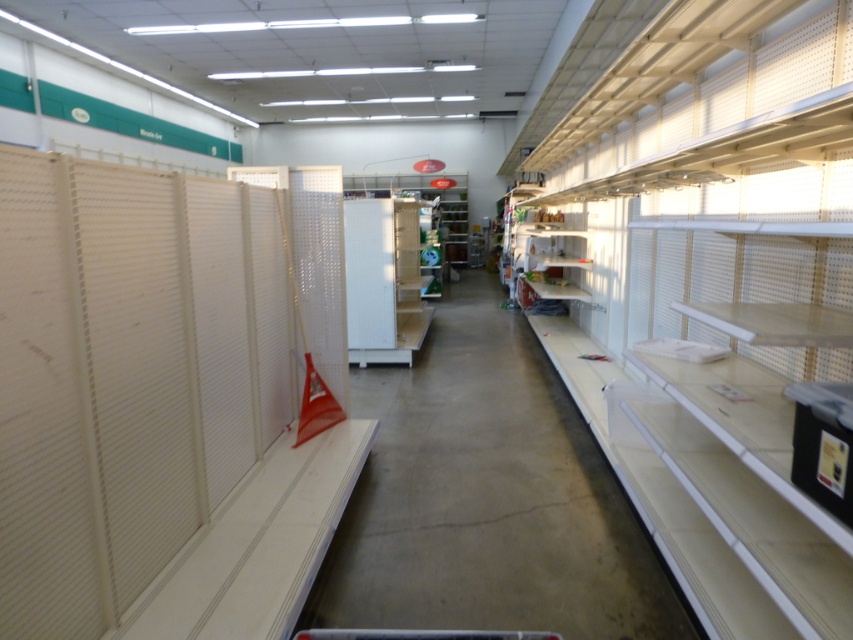
Is white plastic shelves at center below white matte shelf at center?

Indeed, white plastic shelves at center is positioned under white matte shelf at center.

Which is behind, point (418, 499) or point (412, 240)?

The point (412, 240) is behind.

Find the location of a particular element. The width and height of the screenshot is (853, 640). white plastic shelves at center is located at coordinates (486, 497).